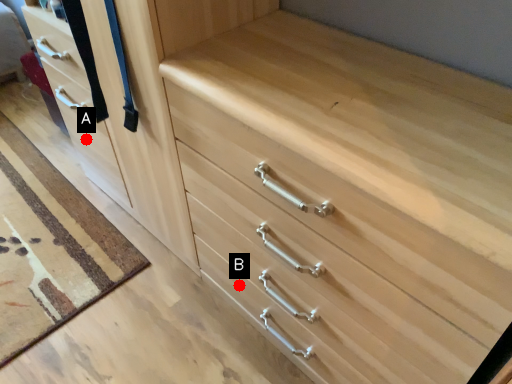
Question: Two points are circled on the image, labeled by A and B beside each circle. Which point is closer to the camera?

Choices:
 (A) A is closer
 (B) B is closer

Answer: (B)